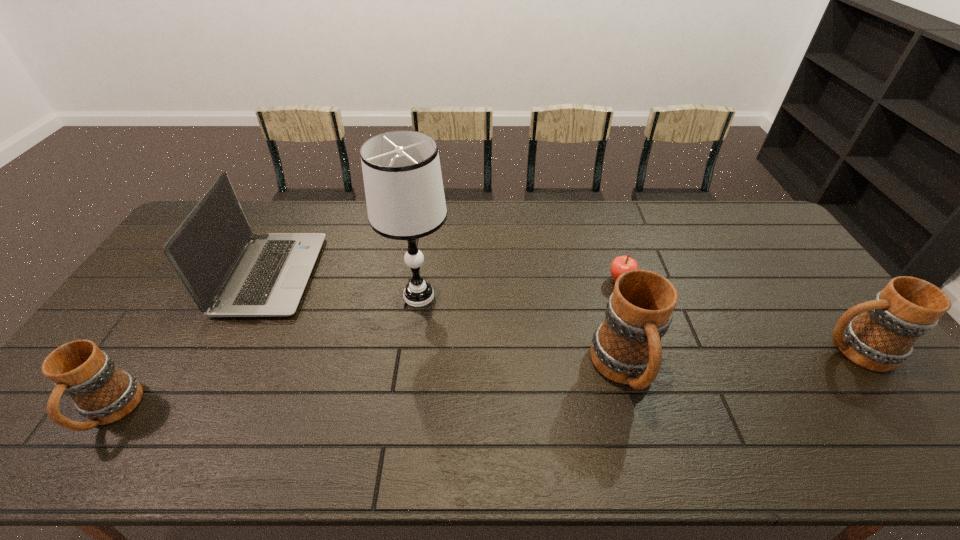
You are a GUI agent. You are given a task and a screenshot of the screen. Output one action in this format:
    pyautogui.click(x=<x>, y=<y>)
    Task: Click on the vacant position for inserting another mug evenly
    The image size is (960, 540).
    Given the screenshot: What is the action you would take?
    click(x=377, y=390)